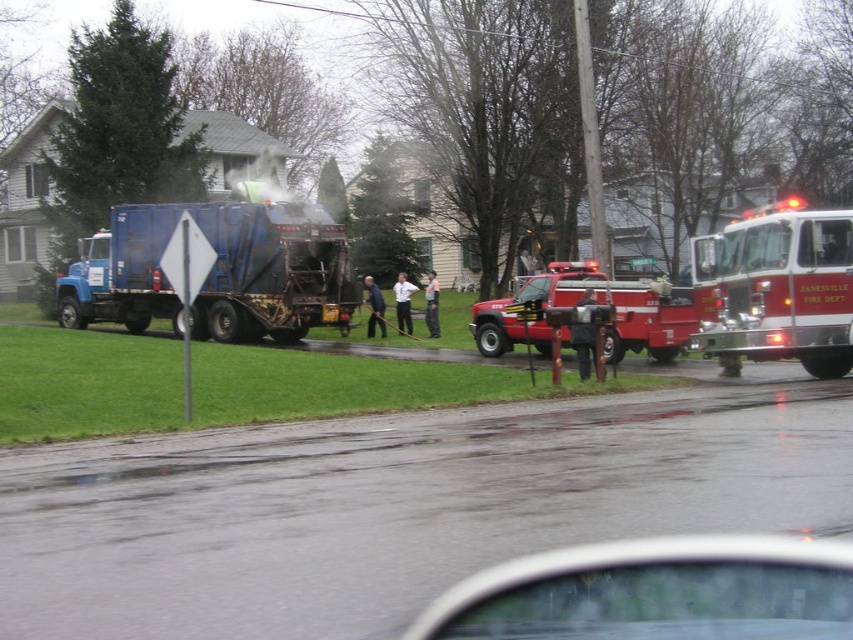
Question: Which point appears closest to the camera in this image?

Choices:
 (A) (659, 301)
 (B) (561, 577)
 (C) (791, 310)

Answer: (B)

Question: Which point appears farthest from the camera in this image?

Choices:
 (A) (294, 273)
 (B) (717, 577)
 (C) (711, 333)
 (D) (526, 280)

Answer: (A)

Question: Is shiny red fire truck at right smaller than red matte fire truck at center?

Choices:
 (A) no
 (B) yes

Answer: (B)

Question: Can you confirm if clear glass windshield at center is wider than red matte fire truck at center?

Choices:
 (A) yes
 (B) no

Answer: (B)

Question: Which object is positioned farthest from the red matte fire truck at center?

Choices:
 (A) shiny red fire truck at right
 (B) clear glass windshield at center

Answer: (B)

Question: Does clear glass windshield at center appear over red matte fire truck at center?

Choices:
 (A) no
 (B) yes

Answer: (A)